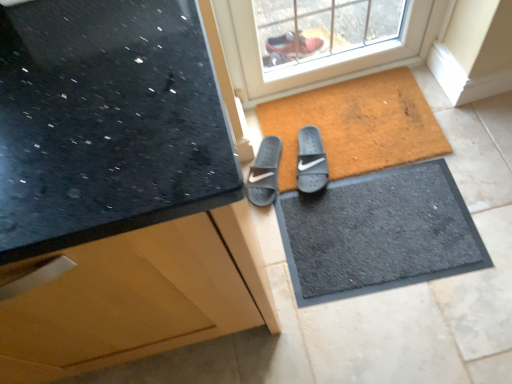
Find the location of `vacant area that lies to the right of matte black countertop at upper left`. vacant area that lies to the right of matte black countertop at upper left is located at coordinates (365, 268).